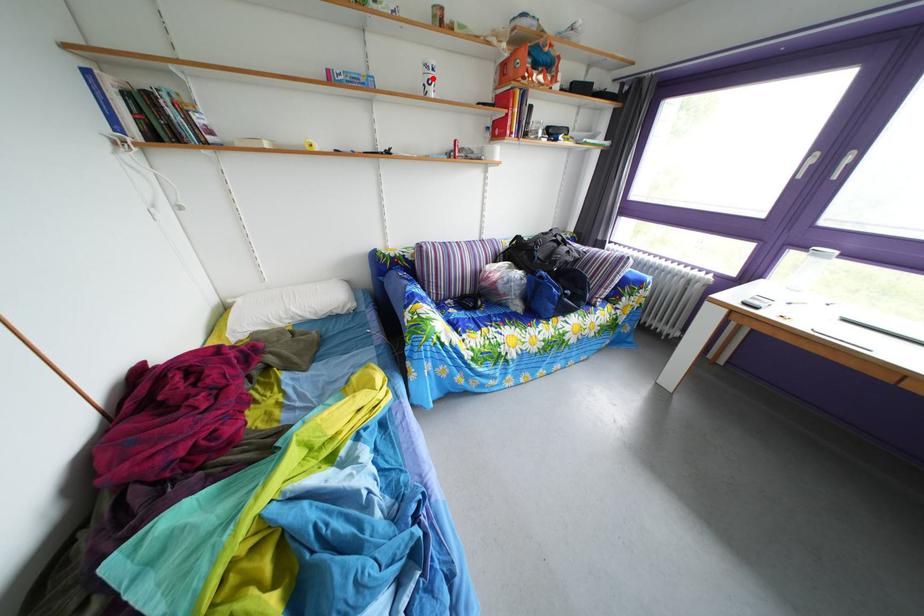
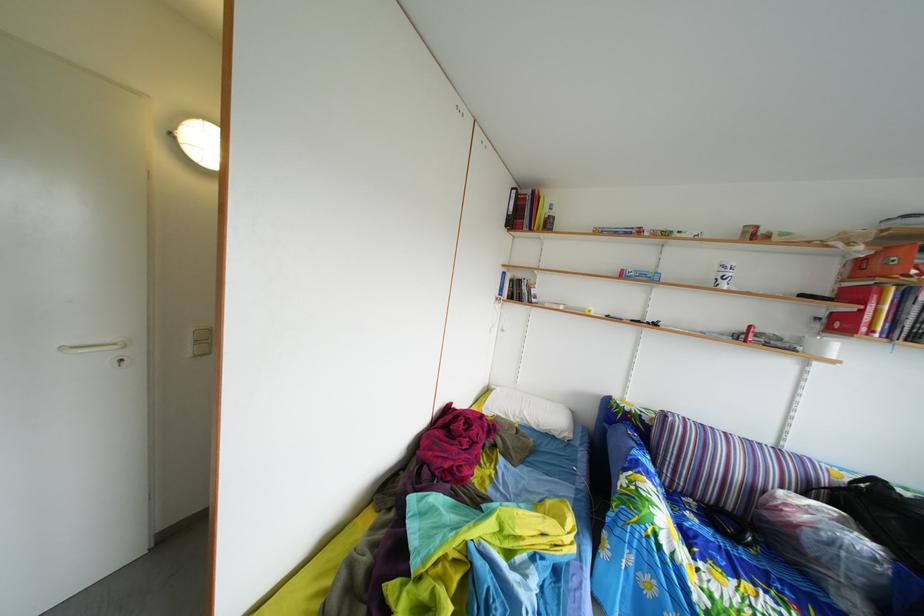
In the second image, find the point that corresponds to the highlighted location in the first image.

(727, 276)